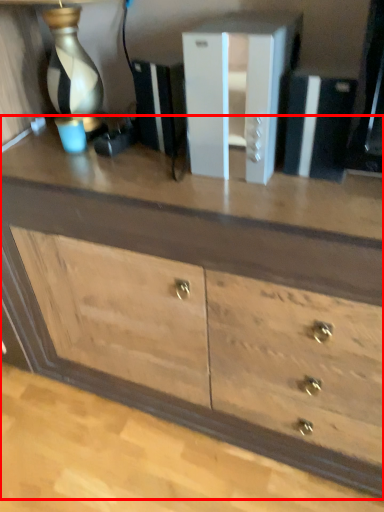
Question: Observing the image, what is the correct spatial positioning of chest of drawers (annotated by the red box) in reference to file cabinet?

Choices:
 (A) right
 (B) left

Answer: (B)